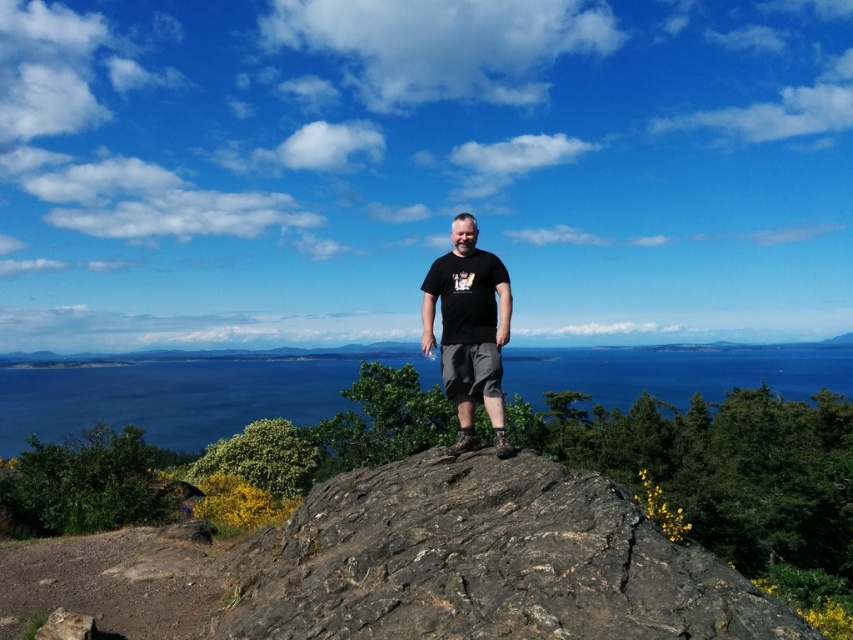
Does point (680, 586) come farther from viewer compared to point (453, 336)?

That is False.

Based on the photo, which of these two, rough textured rock at center or black matte t-shirt at center, stands shorter?

With less height is rough textured rock at center.

Does point (407, 637) lie in front of point (473, 308)?

Yes, it is in front of point (473, 308).

Locate an element on the screen. This screenshot has height=640, width=853. rough textured rock at center is located at coordinates (485, 563).